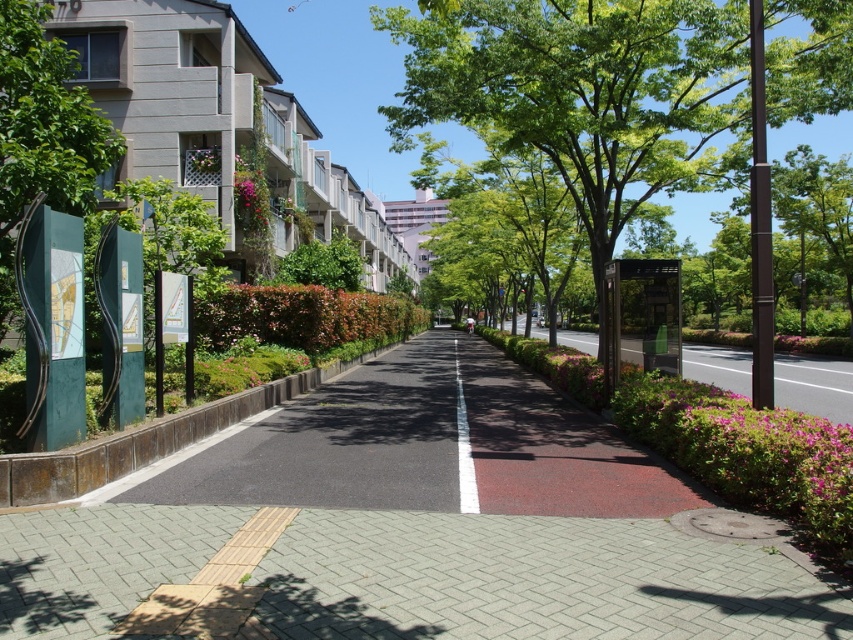
Question: Is smooth asphalt road at center to the left of green grass at center from the viewer's perspective?

Choices:
 (A) no
 (B) yes

Answer: (B)

Question: Estimate the real-world distances between objects in this image. Which object is closer to the smooth asphalt road at center?

Choices:
 (A) green grass at center
 (B) green leafy tree at center
 (C) white smooth line at center

Answer: (C)

Question: Among these objects, which one is nearest to the camera?

Choices:
 (A) smooth asphalt road at center
 (B) red asphalt pavement at center
 (C) white smooth line at center
 (D) green grass at center

Answer: (A)

Question: Does red asphalt pavement at center appear over green leafy tree at left?

Choices:
 (A) yes
 (B) no

Answer: (B)

Question: Which object appears closest to the camera in this image?

Choices:
 (A) smooth asphalt road at center
 (B) red asphalt pavement at center

Answer: (A)

Question: In this image, where is smooth asphalt road at center located relative to green grass at center?

Choices:
 (A) left
 (B) right

Answer: (A)